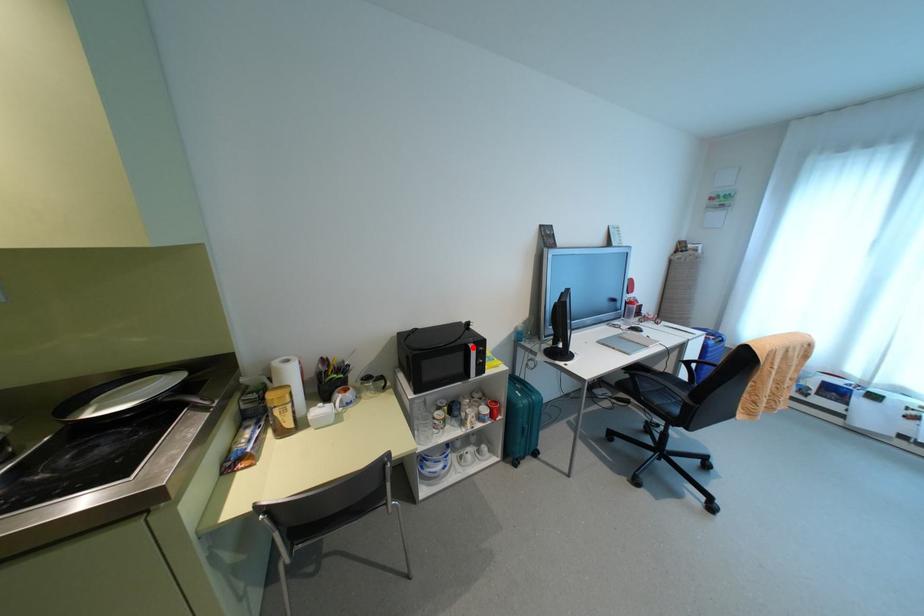
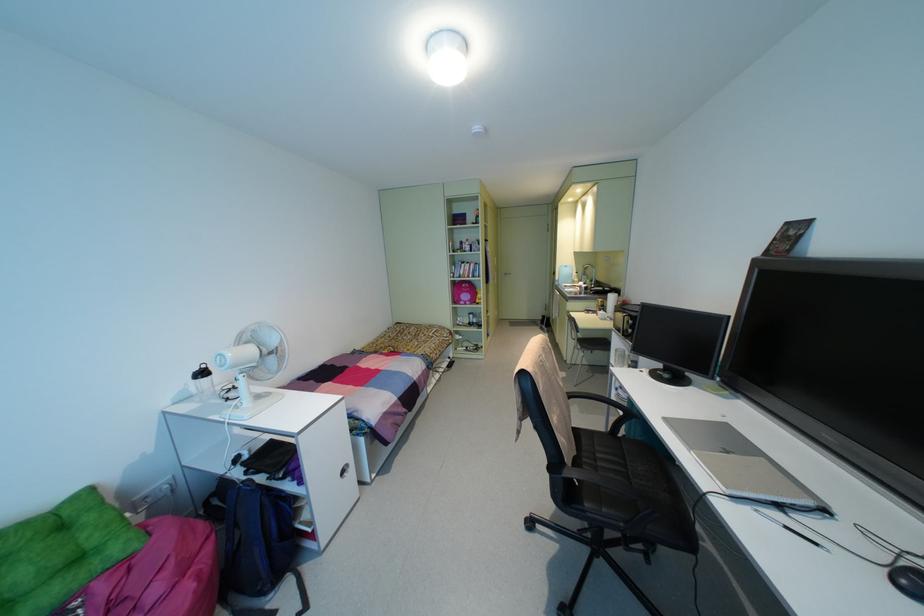
Question: I am providing you with two images of the same scene from different viewpoints. A red point is marked on the first image. At the location where the point appears in image 1, is it still visible in image 2?

Choices:
 (A) Yes
 (B) No

Answer: (B)